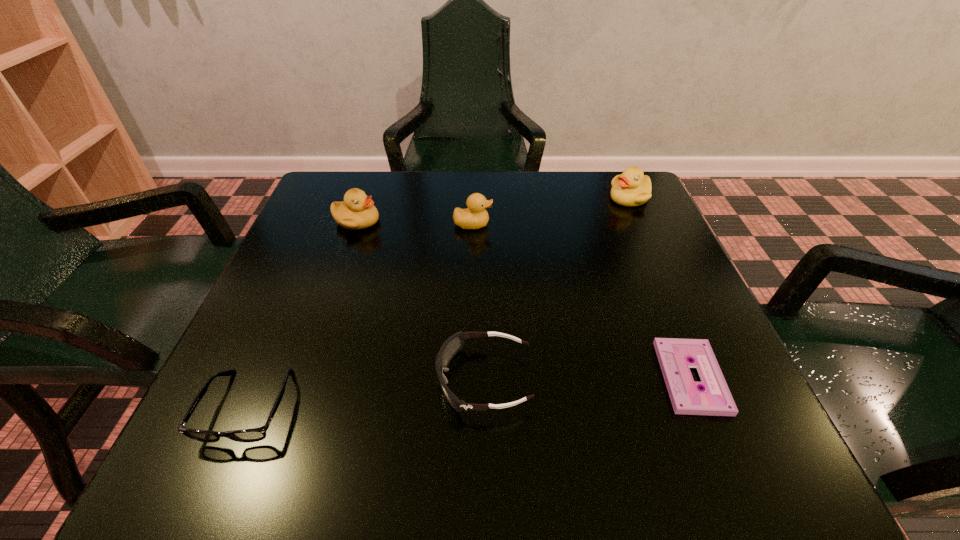
Locate an element on the screen. The height and width of the screenshot is (540, 960). free spot at the far right corner of the desktop is located at coordinates (615, 221).

Where is `free space between the spectacles and the rightmost duckling`? free space between the spectacles and the rightmost duckling is located at coordinates (439, 302).

Identify the location of free spot between the leftmost duckling and the goggles. (420, 300).

The width and height of the screenshot is (960, 540). Find the location of `vacant space that's between the spectacles and the second duckling from left to right`. vacant space that's between the spectacles and the second duckling from left to right is located at coordinates (361, 315).

Find the location of `empty space between the rightmost duckling and the spectacles`. empty space between the rightmost duckling and the spectacles is located at coordinates (439, 302).

Locate an element on the screen. This screenshot has height=540, width=960. unoccupied position between the shortest object and the second duckling from left to right is located at coordinates tap(582, 301).

Identify the location of free space between the spectacles and the videotape. The width and height of the screenshot is (960, 540). (469, 392).

Find the location of a particular element. Image resolution: width=960 pixels, height=540 pixels. free space between the spectacles and the second duckling from right to left is located at coordinates (361, 315).

Where is `empty location between the goggles and the leftmost duckling`? Image resolution: width=960 pixels, height=540 pixels. empty location between the goggles and the leftmost duckling is located at coordinates (420, 300).

Where is `free space between the leftmost duckling and the shortest object`? This screenshot has width=960, height=540. free space between the leftmost duckling and the shortest object is located at coordinates (524, 299).